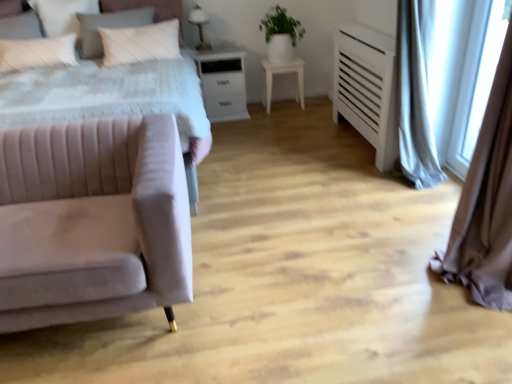
Question: Which is correct: white matte table at center is inside white glossy table lamp at upper center, or outside of it?

Choices:
 (A) outside
 (B) inside

Answer: (A)

Question: In the image, is white matte table at center positioned in front of or behind white glossy table lamp at upper center?

Choices:
 (A) front
 (B) behind

Answer: (B)

Question: Which is nearer to the transparent glass window screen at right?

Choices:
 (A) white glossy table lamp at upper center
 (B) velvet pink bed at left
 (C) white matte table at center
 (D) green matte plant at upper center
 (E) white soft pillow at upper left, the 1th pillow in the left-to-right sequence

Answer: (C)

Question: Which object is positioned closest to the white glossy table lamp at upper center?

Choices:
 (A) white soft pillow at upper left, the 1th pillow in the left-to-right sequence
 (B) green matte plant at upper center
 (C) transparent glass window screen at right
 (D) light gray fabric curtain at right
 (E) velvet pink bed at left

Answer: (E)